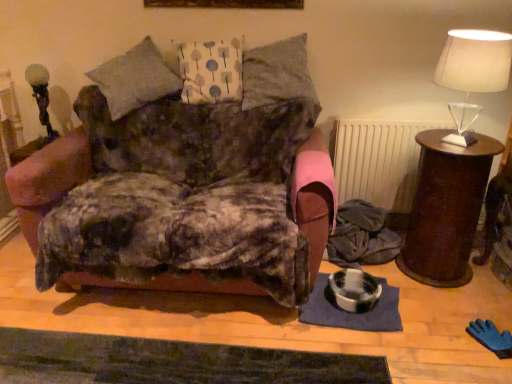
At what (x,y) coordinates should I click in order to perform the action: click on velvet floral armchair at center. Please return your answer as a coordinate pair (x, y). This screenshot has height=384, width=512. Looking at the image, I should click on (183, 130).

Measure the distance between point (46, 93) and camera.

Point (46, 93) and camera are 2.61 meters apart from each other.

Identify the location of textured gray pillow at upper center, the 2th pillow when ordered from left to right. The width and height of the screenshot is (512, 384). (279, 75).

The image size is (512, 384). What are the coordinates of `white textured radiator at center` in the screenshot? It's located at (378, 160).

This screenshot has height=384, width=512. What do you see at coordinates (446, 208) in the screenshot?
I see `brown wooden side table at right` at bounding box center [446, 208].

What is the approximate height of translucent glass table lamp at upper right, which is the 2th table lamp in left-to-right order?

translucent glass table lamp at upper right, which is the 2th table lamp in left-to-right order, is 19.46 inches in height.

The height and width of the screenshot is (384, 512). I want to click on white fabric pillow at center, arranged as the second pillow when viewed from the right, so click(211, 71).

This screenshot has height=384, width=512. Describe the element at coordinates (211, 71) in the screenshot. I see `white fabric pillow at center, arranged as the second pillow when viewed from the right` at that location.

Find the location of a particular element. velvet floral armchair at center is located at coordinates click(x=183, y=130).

What's the angular difference between velvet floral armchair at center and textured gray pillow at upper center, the 2th pillow when ordered from left to right,'s facing directions?

There is a 0.758-degree angle between the facing directions of velvet floral armchair at center and textured gray pillow at upper center, the 2th pillow when ordered from left to right.

Is point (296, 81) closer or farther from the camera than point (278, 54)?

Point (296, 81) is closer to the camera than point (278, 54).

Looking at the image, does velvet floral armchair at center seem bigger or smaller compared to textured gray pillow at upper center, the 2th pillow when ordered from left to right?

Clearly, velvet floral armchair at center is larger in size than textured gray pillow at upper center, the 2th pillow when ordered from left to right.

Could you tell me if velvet floral armchair at center is facing textured gray pillow at upper center, which is counted as the 1th pillow, starting from the right?

No, velvet floral armchair at center is not turned towards textured gray pillow at upper center, which is counted as the 1th pillow, starting from the right.

Considering the relative sizes of brown wooden side table at right and velvet floral armchair at center in the image provided, is brown wooden side table at right bigger than velvet floral armchair at center?

Incorrect, brown wooden side table at right is not larger than velvet floral armchair at center.

Which point is more distant from viewer, (413, 278) or (127, 152)?

Point (127, 152)

How different are the orientations of brown wooden side table at right and velvet floral armchair at center in degrees?

1.17 degrees.

How much distance is there between brown wooden side table at right and velvet floral armchair at center?

The distance of brown wooden side table at right from velvet floral armchair at center is 37.32 inches.

Is brown wooden side table at right further to camera compared to white fabric pillow at center, arranged as the second pillow when viewed from the right?

No, brown wooden side table at right is in front of white fabric pillow at center, arranged as the second pillow when viewed from the right.

From the picture: From the image's perspective, is brown wooden side table at right on top of white fabric pillow at center, arranged as the second pillow when viewed from the right?

No.

The height and width of the screenshot is (384, 512). I want to click on the 2nd pillow behind the brown wooden side table at right, so click(211, 71).

Are brown wooden side table at right and white fabric pillow at center, marked as the first pillow in a left-to-right arrangement, located far from each other?

Yes, brown wooden side table at right is far from white fabric pillow at center, marked as the first pillow in a left-to-right arrangement.

What's the angular difference between velvet floral armchair at center and white textured radiator at center's facing directions?

They differ by 1.67 degrees in their facing directions.

From the image's perspective, which object appears higher, velvet floral armchair at center or white textured radiator at center?

From the image's view, white textured radiator at center is above.

Considering the sizes of velvet floral armchair at center and white textured radiator at center in the image, is velvet floral armchair at center bigger or smaller than white textured radiator at center?

In the image, velvet floral armchair at center appears to be larger than white textured radiator at center.

Can we say velvet floral armchair at center lies outside white textured radiator at center?

→ Yes, velvet floral armchair at center is not within white textured radiator at center.

Find the location of a particular element. pillow that is the 1st object to the right of the velvet floral armchair at center, starting at the anchor is located at coordinates (211, 71).

Considering the sizes of objects velvet floral armchair at center and white fabric pillow at center, arranged as the second pillow when viewed from the right, in the image provided, who is bigger, velvet floral armchair at center or white fabric pillow at center, arranged as the second pillow when viewed from the right,?

Bigger between the two is velvet floral armchair at center.

Could you tell me if velvet floral armchair at center is facing white fabric pillow at center, marked as the first pillow in a left-to-right arrangement?

No, velvet floral armchair at center is not oriented towards white fabric pillow at center, marked as the first pillow in a left-to-right arrangement.

Based on the photo, would you say velvet floral armchair at center is a long distance from white fabric pillow at center, marked as the first pillow in a left-to-right arrangement?

That's not correct — velvet floral armchair at center is a little close to white fabric pillow at center, marked as the first pillow in a left-to-right arrangement.

Considering the sizes of matte glass table lamp at left, arranged as the 1th table lamp when viewed from the back, and white fabric pillow at center, arranged as the second pillow when viewed from the right, in the image, is matte glass table lamp at left, arranged as the 1th table lamp when viewed from the back, wider or thinner than white fabric pillow at center, arranged as the second pillow when viewed from the right,?

matte glass table lamp at left, arranged as the 1th table lamp when viewed from the back, is thinner than white fabric pillow at center, arranged as the second pillow when viewed from the right.

Is matte glass table lamp at left, the second table lamp viewed from the front, far from white fabric pillow at center, marked as the first pillow in a left-to-right arrangement?

Absolutely, matte glass table lamp at left, the second table lamp viewed from the front, is distant from white fabric pillow at center, marked as the first pillow in a left-to-right arrangement.

Is matte glass table lamp at left, which ranks as the 2th table lamp in right-to-left order, bigger than white fabric pillow at center, marked as the first pillow in a left-to-right arrangement?

Actually, matte glass table lamp at left, which ranks as the 2th table lamp in right-to-left order, might be smaller than white fabric pillow at center, marked as the first pillow in a left-to-right arrangement.

From a real-world perspective, is brown wooden side table at right located beneath translucent glass table lamp at upper right, which is the 2th table lamp in left-to-right order?

Yes, from a real-world perspective, brown wooden side table at right is under translucent glass table lamp at upper right, which is the 2th table lamp in left-to-right order.

Measure the distance between brown wooden side table at right and translucent glass table lamp at upper right, positioned as the 2th table lamp in back-to-front order.

The distance of brown wooden side table at right from translucent glass table lamp at upper right, positioned as the 2th table lamp in back-to-front order, is 22.08 inches.

Is brown wooden side table at right shorter than translucent glass table lamp at upper right, which ranks as the first table lamp in front-to-back order?

In fact, brown wooden side table at right may be taller than translucent glass table lamp at upper right, which ranks as the first table lamp in front-to-back order.

Is brown wooden side table at right facing away from translucent glass table lamp at upper right, positioned as the 2th table lamp in back-to-front order?

No, brown wooden side table at right is not facing the opposite direction of translucent glass table lamp at upper right, positioned as the 2th table lamp in back-to-front order.

Which pillow is the 1st one when counting from the back of the velvet floral armchair at center? Please provide its 2D coordinates.

[(279, 75)]

Where is `furniture in front of the brown wooden side table at right`? The image size is (512, 384). furniture in front of the brown wooden side table at right is located at coordinates (183, 130).

In the scene shown: Which object lies further to the anchor point matte glass table lamp at left, which ranks as the 2th table lamp in right-to-left order, white textured radiator at center or brown wooden side table at right?

brown wooden side table at right is positioned further to the anchor matte glass table lamp at left, which ranks as the 2th table lamp in right-to-left order.

Estimate the real-world distances between objects in this image. Which object is closer to brown wooden side table at right, textured gray pillow at upper center, the 2th pillow when ordered from left to right, or translucent glass table lamp at upper right, positioned as the 2th table lamp in back-to-front order?

Among the two, translucent glass table lamp at upper right, positioned as the 2th table lamp in back-to-front order, is located nearer to brown wooden side table at right.

Consider the image. Looking at the image, which one is located closer to brown wooden side table at right, white fabric pillow at center, arranged as the second pillow when viewed from the right, or velvet floral armchair at center?

→ velvet floral armchair at center lies closer to brown wooden side table at right than the other object.

From the image, which object appears to be farther from velvet floral armchair at center, white fabric pillow at center, arranged as the second pillow when viewed from the right, or white textured radiator at center?

Among the two, white textured radiator at center is located further to velvet floral armchair at center.

Estimate the real-world distances between objects in this image. Which object is further from brown wooden side table at right, translucent glass table lamp at upper right, positioned as the 2th table lamp in back-to-front order, or white textured radiator at center?

The object further to brown wooden side table at right is translucent glass table lamp at upper right, positioned as the 2th table lamp in back-to-front order.

Considering their positions, is textured gray pillow at upper center, which is counted as the 1th pillow, starting from the right, positioned closer to translucent glass table lamp at upper right, which is the 2th table lamp in left-to-right order, than white fabric pillow at center, arranged as the second pillow when viewed from the right?

The object closer to translucent glass table lamp at upper right, which is the 2th table lamp in left-to-right order, is textured gray pillow at upper center, which is counted as the 1th pillow, starting from the right.

Looking at this image, from the image, which object appears to be nearer to matte glass table lamp at left, arranged as the 1th table lamp when viewed from the back, velvet floral armchair at center or white textured radiator at center?

velvet floral armchair at center is positioned closer to the anchor matte glass table lamp at left, arranged as the 1th table lamp when viewed from the back.

Which object lies nearer to the anchor point velvet floral armchair at center, white fabric pillow at center, marked as the first pillow in a left-to-right arrangement, or translucent glass table lamp at upper right, which is the first table lamp in right-to-left order?

white fabric pillow at center, marked as the first pillow in a left-to-right arrangement.

This screenshot has width=512, height=384. I want to click on radiator between matte glass table lamp at left, the 1th table lamp in the left-to-right sequence, and brown wooden side table at right, in the horizontal direction, so click(378, 160).

I want to click on furniture between matte glass table lamp at left, which ranks as the 2th table lamp in right-to-left order, and textured gray pillow at upper center, the 2th pillow when ordered from left to right, from left to right, so (x=183, y=130).

Find the location of a particular element. This screenshot has height=384, width=512. radiator between white fabric pillow at center, arranged as the second pillow when viewed from the right, and brown wooden side table at right from left to right is located at coordinates (378, 160).

Find the location of `furniture between matte glass table lamp at left, the second table lamp viewed from the front, and translucent glass table lamp at upper right, which is the first table lamp in right-to-left order, in the horizontal direction`. furniture between matte glass table lamp at left, the second table lamp viewed from the front, and translucent glass table lamp at upper right, which is the first table lamp in right-to-left order, in the horizontal direction is located at coordinates (183, 130).